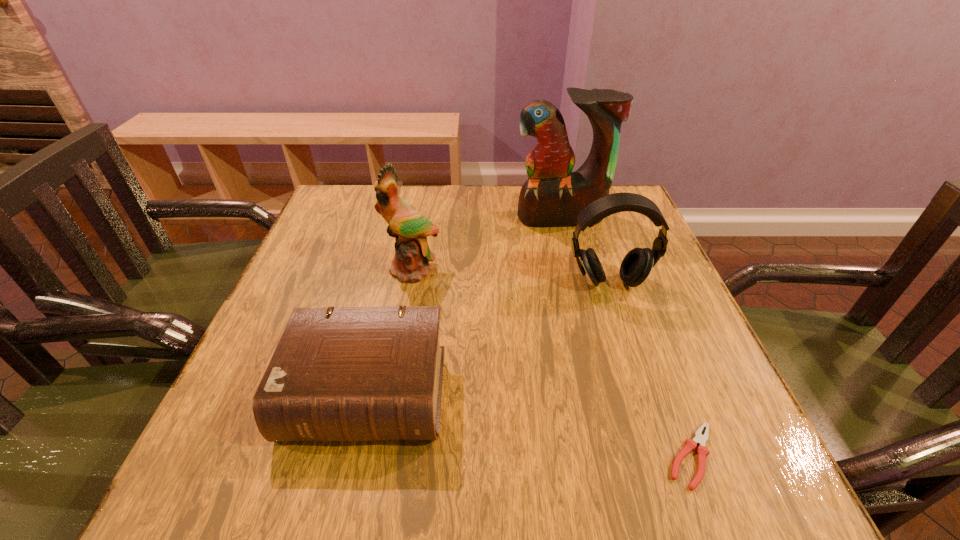
Locate an element on the screen. the right parrot is located at coordinates (553, 195).

At what (x,y) coordinates should I click in order to perform the action: click on the taller parrot. Please return your answer as a coordinate pair (x, y). This screenshot has width=960, height=540. Looking at the image, I should click on coord(553,195).

Locate an element on the screen. The width and height of the screenshot is (960, 540). the left parrot is located at coordinates (410, 228).

Image resolution: width=960 pixels, height=540 pixels. I want to click on the nearer parrot, so click(x=410, y=228).

Locate an element on the screen. earphone is located at coordinates (636, 266).

Locate an element on the screen. the fourth tallest object is located at coordinates (350, 373).

In order to click on pliers in this screenshot , I will do `click(690, 444)`.

Identify the location of free space located 0.050m at the face of the farther parrot. The image size is (960, 540). (566, 241).

The image size is (960, 540). Identify the location of free space located on the front-facing side of the left parrot. (389, 399).

The height and width of the screenshot is (540, 960). What are the coordinates of `free region located on the ear cups of the earphone` in the screenshot? It's located at (626, 334).